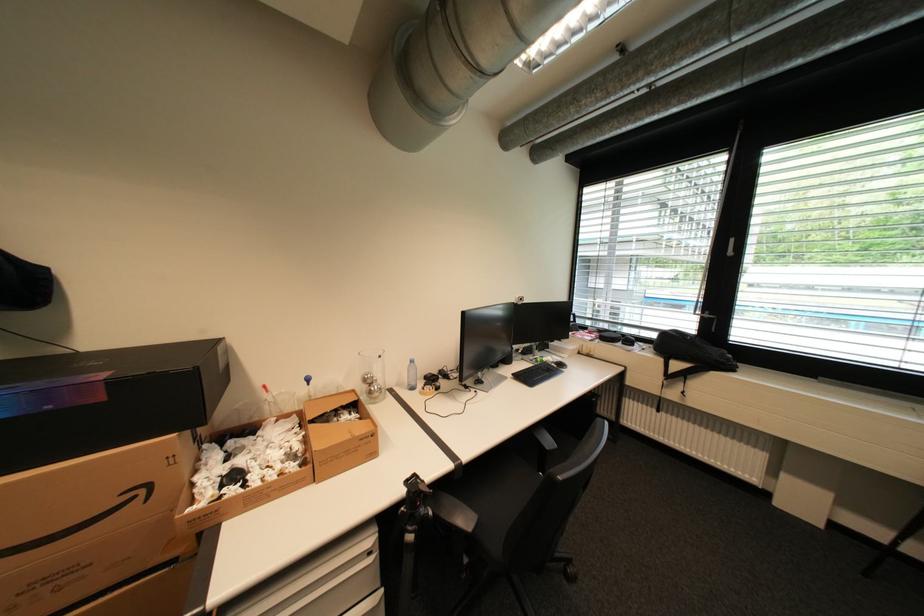
The location [90,523] corresponds to which object?

This point indicates the open cardboard box.